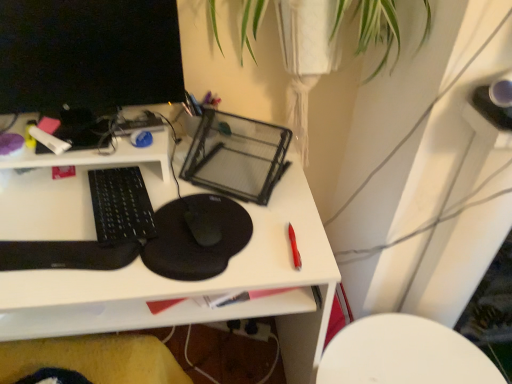
Question: Does white plastic chair at lower right touch white matte marker at upper left, the second stationery from the front?

Choices:
 (A) yes
 (B) no

Answer: (B)

Question: Could you tell me if white plastic chair at lower right is facing white matte marker at upper left, positioned as the second stationery in right-to-left order?

Choices:
 (A) no
 (B) yes

Answer: (A)

Question: Is white plastic chair at lower right located outside white matte marker at upper left, the second stationery ordered from the bottom?

Choices:
 (A) no
 (B) yes

Answer: (B)

Question: Is white plastic chair at lower right behind white matte marker at upper left, the 1th stationery viewed from the top?

Choices:
 (A) yes
 (B) no

Answer: (A)

Question: From the image's perspective, is white plastic chair at lower right below white matte marker at upper left, the 1th stationery viewed from the top?

Choices:
 (A) yes
 (B) no

Answer: (A)

Question: From the image's perspective, is white plastic chair at lower right on white matte marker at upper left, the second stationery ordered from the bottom?

Choices:
 (A) yes
 (B) no

Answer: (B)

Question: From the image's perspective, would you say black matte mouse at center is positioned over black matte mousepad at center?

Choices:
 (A) no
 (B) yes

Answer: (B)

Question: Is black matte mouse at center beside black matte mousepad at center?

Choices:
 (A) no
 (B) yes

Answer: (A)

Question: Does black matte mouse at center have a larger size compared to black matte mousepad at center?

Choices:
 (A) yes
 (B) no

Answer: (B)

Question: Is black matte mouse at center to the left of black matte mousepad at center from the viewer's perspective?

Choices:
 (A) yes
 (B) no

Answer: (B)

Question: From the image's perspective, does black matte mouse at center appear lower than black matte mousepad at center?

Choices:
 (A) yes
 (B) no

Answer: (B)

Question: From a real-world perspective, does black matte mouse at center sit lower than black matte mousepad at center?

Choices:
 (A) no
 (B) yes

Answer: (A)

Question: Is red plastic pen at right, arranged as the second stationery when viewed from the top, aimed at black glossy computer monitor at upper left?

Choices:
 (A) yes
 (B) no

Answer: (B)